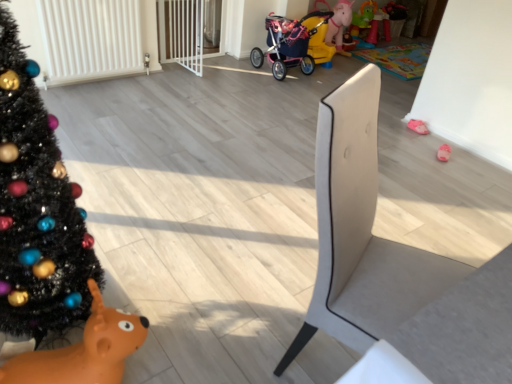
Question: From a real-world perspective, is pink fabric slipper at lower right, acting as the 1th toy starting from the top, positioned above or below orange rubber reindeer at lower left, the 2th toy when ordered from right to left?

Choices:
 (A) above
 (B) below

Answer: (B)

Question: From the image's perspective, relative to orange rubber reindeer at lower left, which appears as the second toy when viewed from the back, is pink fabric slipper at lower right, acting as the 1th toy starting from the top, above or below?

Choices:
 (A) below
 (B) above

Answer: (B)

Question: Which object is the closest to the pink fabric baby carriage at center?

Choices:
 (A) suede-like beige chair at center-right
 (B) orange rubber reindeer at lower left, the second toy in the top-to-bottom sequence
 (C) pink fabric slipper at lower right, marked as the 2th toy in a left-to-right arrangement
 (D) white matte radiator at upper left
 (E) black matte christmas tree at left

Answer: (C)

Question: Which object is positioned farthest from the black matte christmas tree at left?

Choices:
 (A) orange rubber reindeer at lower left, the second toy in the top-to-bottom sequence
 (B) suede-like beige chair at center-right
 (C) pink fabric slipper at lower right, marked as the 2th toy in a left-to-right arrangement
 (D) pink fabric baby carriage at center
 (E) white matte radiator at upper left

Answer: (D)